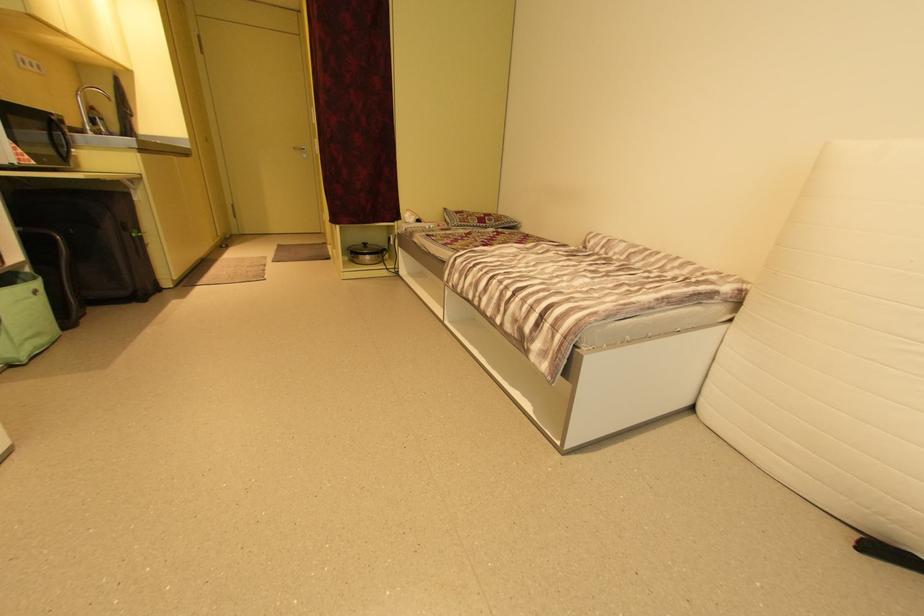
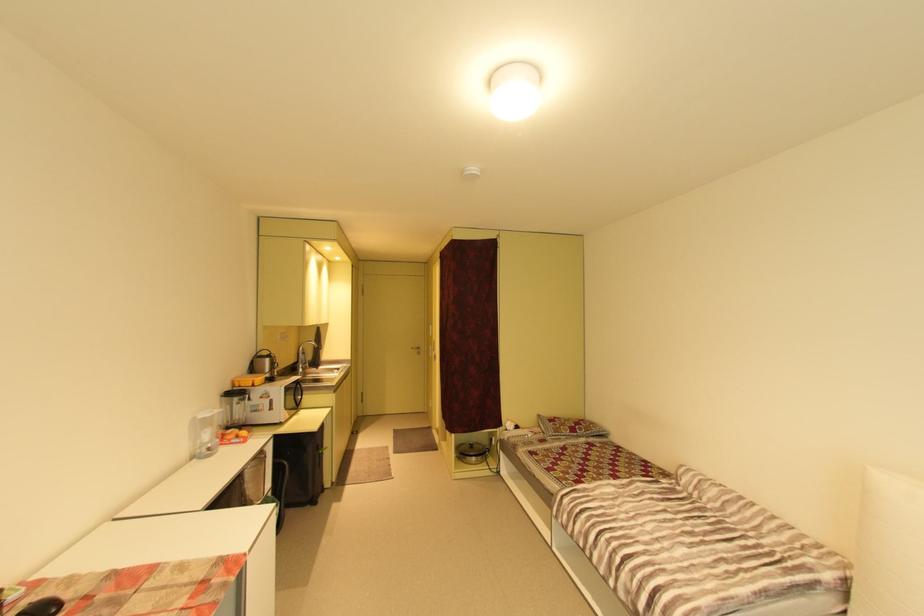
The point at (x=300, y=148) is marked in the first image. Where is the corresponding point in the second image?

(419, 349)